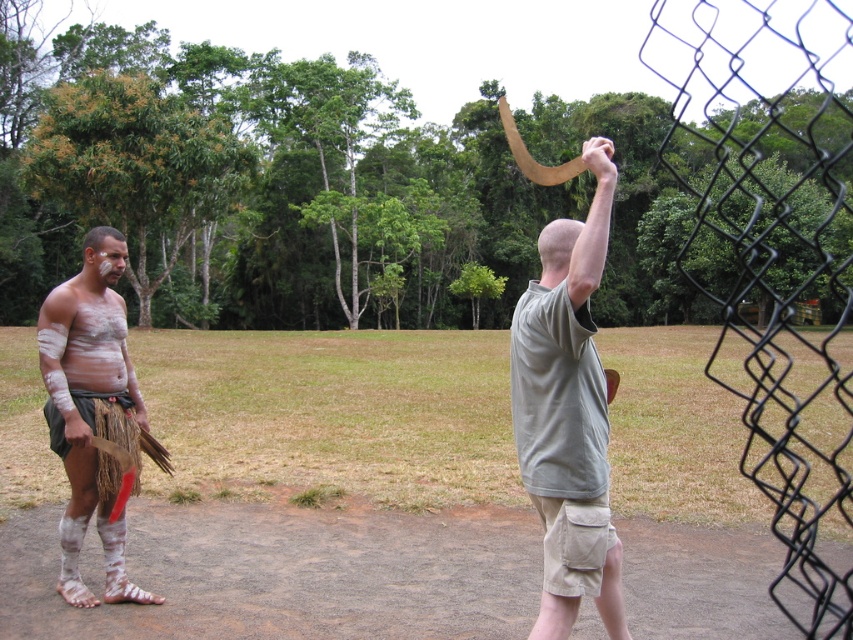
You are an anthropologist observing the scene from a distance. You need to determine which object is nearer to you between the matte brown horn at upper right and the matte white skin at left. Based on the spatial arrangement, which one is closer?

The matte brown horn at upper right is closer to the viewer than the matte white skin at left, so the matte brown horn at upper right is nearer to you.

You are a photographer trying to capture a closeup shot of both the matte brown horn at upper right and the matte white skin at left in the same frame. Given that your camera has a fixed focal length and a field of view that can cover 10 feet, will you be able to include both objects in the photo?

The matte brown horn at upper right and the matte white skin at left are 8.42 feet apart, which is within the camera field of view that can cover 10 feet. Therefore, you can include both objects in the photo.

You are an anthropologist observing the scene. You need to determine which object is bigger between the matte brown horn at upper right and the matte white skin at left. Which one is larger?

The matte brown horn at upper right is larger in size than the matte white skin at left.